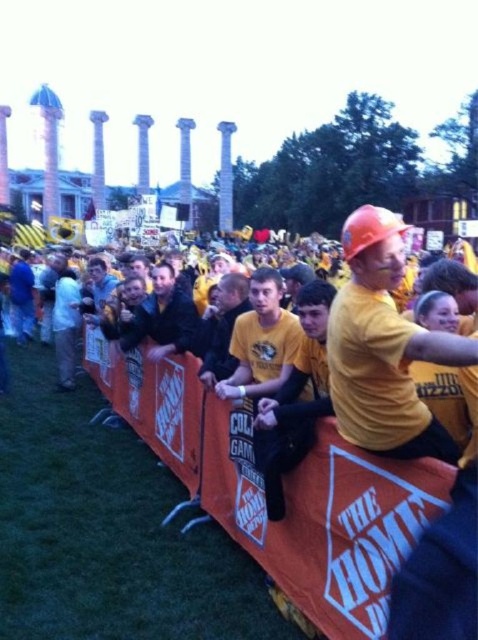
You are standing at the point with coordinates point (372, 368) and want to move towards the barrier with orange panels. Will you have to walk towards the point (339, 566) or away from it?

Point (339, 566) is closer to the viewer than point (372, 368). Since you are at point (372, 368) and want to move towards the barrier, you need to walk towards point (339, 566) because it is closer to the barrier and your direction of movement would align with that point.

You are standing at point (x=284, y=490) in the image. What object is directly beneath your feet?

The orange fabric barrier at center is directly beneath the point (x=284, y=490).

You are a safety inspector at the event and need to ensure that the orange fabric barrier at center is tall enough to prevent anyone from climbing over it. Given that the matte orange hard hat at center is standard issue for workers, does the barrier meet the required height?

The orange fabric barrier at center is taller than the matte orange hard hat at center, so it meets the required height to prevent climbing over it.